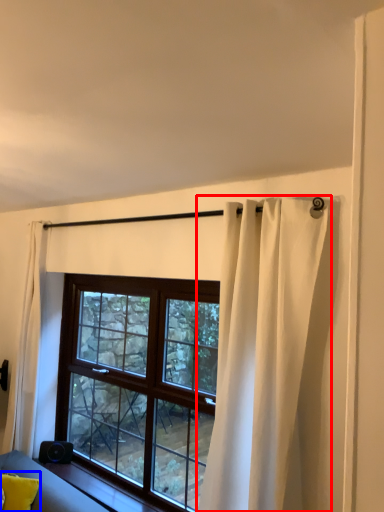
Question: Among these objects, which one is farthest to the camera, curtain (highlighted by a red box) or pillow (highlighted by a blue box)?

Choices:
 (A) curtain
 (B) pillow

Answer: (B)